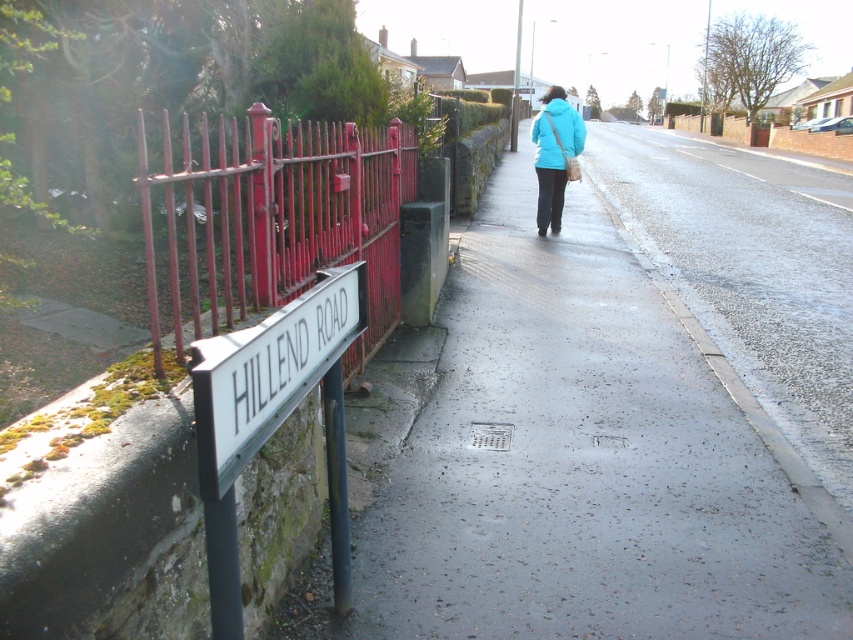
Question: Can you confirm if smooth concrete pavement at center is thinner than red painted metal fence at left?

Choices:
 (A) no
 (B) yes

Answer: (A)

Question: In this image, where is smooth concrete pavement at center located relative to white plastic sign at left?

Choices:
 (A) right
 (B) left

Answer: (A)

Question: Which point is farther from the camera taking this photo?

Choices:
 (A) (575, 145)
 (B) (277, 129)
 (C) (553, 150)

Answer: (A)

Question: Which of the following is the farthest from the observer?

Choices:
 (A) (817, 618)
 (B) (206, 392)

Answer: (A)

Question: Can you confirm if smooth concrete pavement at center is wider than matte blue jacket at center?

Choices:
 (A) no
 (B) yes

Answer: (B)

Question: Among these points, which one is nearest to the camera?

Choices:
 (A) (577, 138)
 (B) (548, 164)
 (C) (241, 392)
 (D) (190, 301)

Answer: (C)